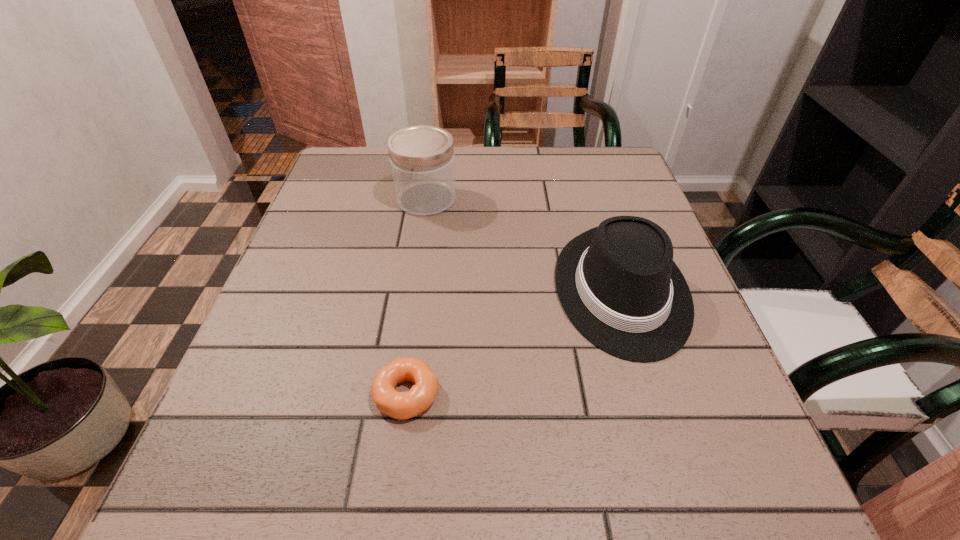
Locate an element on the screen. Image resolution: width=960 pixels, height=540 pixels. object that is at the right edge is located at coordinates (618, 284).

In the image, there is a desktop. Identify the location of vacant space at the far edge. This screenshot has height=540, width=960. [x=471, y=147].

Image resolution: width=960 pixels, height=540 pixels. Find the location of `blank space at the near edge of the desktop`. blank space at the near edge of the desktop is located at coordinates (563, 495).

In the image, there is a desktop. Identify the location of vacant space at the left edge. This screenshot has width=960, height=540. (296, 382).

Find the location of a particular element. vacant space at the right edge of the desktop is located at coordinates (650, 410).

The image size is (960, 540). I want to click on vacant space at the far left corner of the desktop, so click(335, 187).

This screenshot has height=540, width=960. Identify the location of vacant space at the far right corner of the desktop. (603, 185).

In the image, there is a desktop. Find the location of `vacant space at the near right corner`. vacant space at the near right corner is located at coordinates (672, 467).

Image resolution: width=960 pixels, height=540 pixels. What are the coordinates of `free space that is in between the rightmost object and the nearest object` in the screenshot? It's located at (515, 342).

This screenshot has width=960, height=540. Identify the location of free space between the second shortest object and the jar. (524, 245).